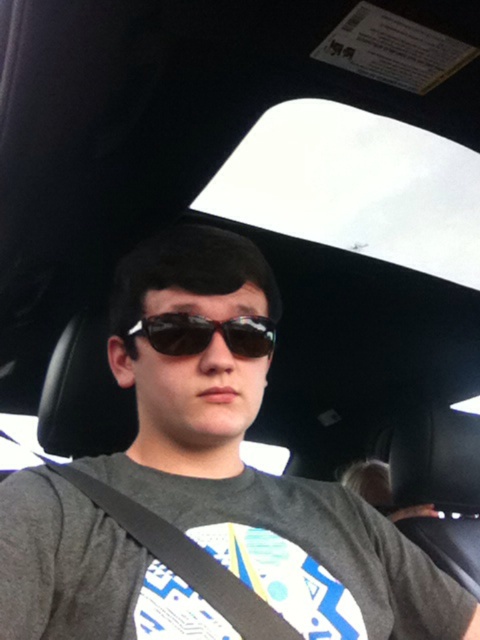
You are a fashion designer looking to create a new accessory line inspired by the car interior shown. You need to know if the matte black sunglasses at center can be placed horizontally on the black fabric seatbelt at center without overlapping. Can they?

The matte black sunglasses at center might be wider than black fabric seatbelt at center, so there is a possibility they won not fit without overlapping if placed horizontally.

You are a passenger in the car and want to check if the seatbelt is properly fastened. You notice both the black fabric seatbelt at center and the sunglasses at center. Which object is closer to the left side of the car?

The black fabric seatbelt at center is closer to the left side of the car because it is positioned to the left of the sunglasses at center.